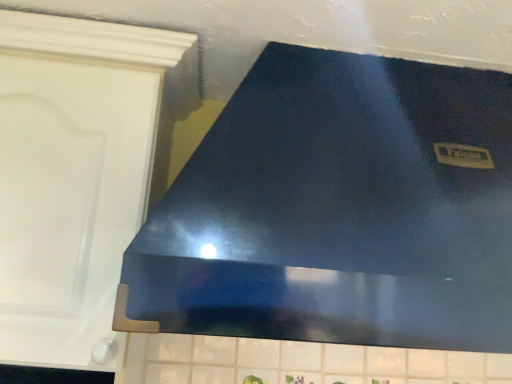
In order to face white matte door at upper left, should I rotate leftwards or rightwards?

Turn left by 23.251 degrees to look at white matte door at upper left.

Locate an element on the screen. The width and height of the screenshot is (512, 384). white matte door at upper left is located at coordinates (68, 202).

What is the approximate height of white matte door at upper left?

It is 74.93 centimeters.

What do you see at coordinates (68, 202) in the screenshot? I see `white matte door at upper left` at bounding box center [68, 202].

The width and height of the screenshot is (512, 384). In order to click on white matte door at upper left in this screenshot , I will do `click(68, 202)`.